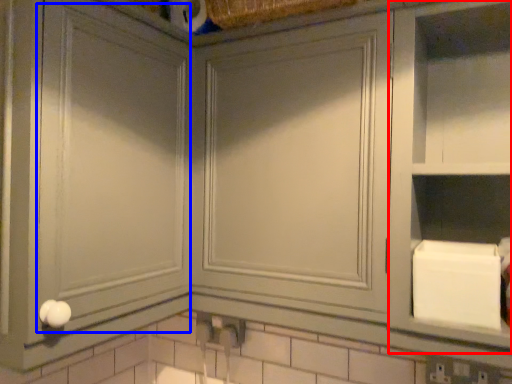
Question: Which of the following is the farthest to the observer, cabinet (highlighted by a red box) or glass door (highlighted by a blue box)?

Choices:
 (A) cabinet
 (B) glass door

Answer: (A)